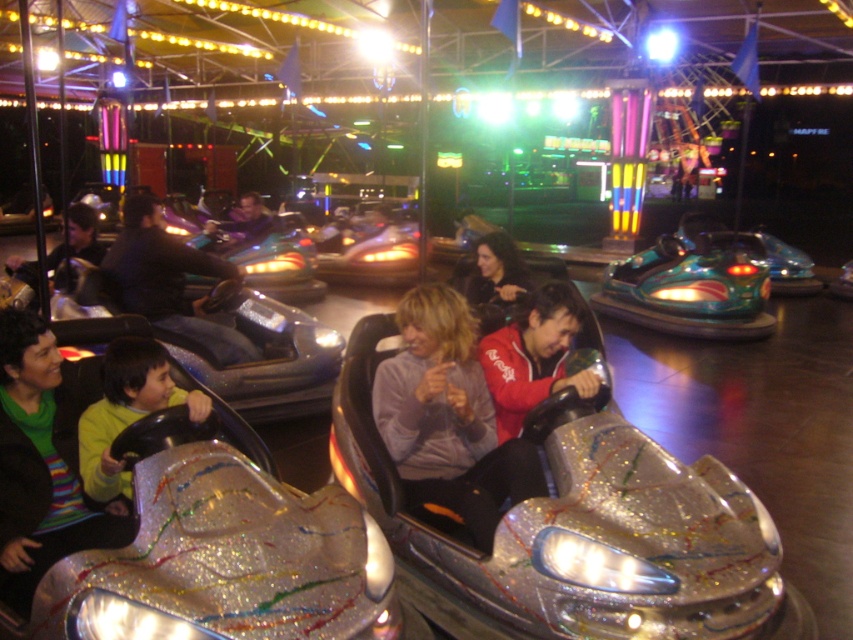
You are standing at the fairground and want to take a photo of the bumper cars. The camera you are using has a focal length of 50mm and an aperture of f2.8. You want to ensure that the point at coordinate point (94,392) is in focus. What is the minimum distance you should be from the bumper cars to achieve this?

The point at coordinate point (94,392) is 11.22 feet from the camera. To ensure this point is in focus, you should position yourself so that the camera is at least 11.22 feet away from the bumper cars.

You are a photographer at the fairground and want to take a photo of both the green striped sweater at lower left and the green matte shirt at lower left. The minimum distance your camera can focus on two objects is 10 inches. Will both items be in focus in the photo?

The green striped sweater at lower left and green matte shirt at lower left are 9.58 inches apart, which is less than the camera minimum focusing distance of 10 inches. Therefore, both items will be in focus in the photo.

In the scene shown: You are a photographer at the fairground and want to capture both the matte black jacket at left and the shiny silver helmet at center in a single frame. Given that your camera has a fixed focal length, which object should you position closer to the camera to ensure both fit within the frame?

Since the matte black jacket at left is narrower than the shiny silver helmet at center, positioning the matte black jacket at left closer to the camera would allow its width to appear larger in the frame, helping both objects fit within the camera view.